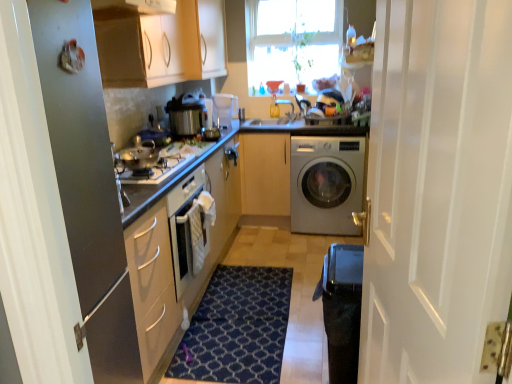
Question: Does white glossy washing machine at center have a greater height compared to black textured water heater at lower right?

Choices:
 (A) yes
 (B) no

Answer: (A)

Question: From the image's perspective, is white glossy washing machine at center beneath black textured water heater at lower right?

Choices:
 (A) yes
 (B) no

Answer: (B)

Question: Is white glossy washing machine at center smaller than black textured water heater at lower right?

Choices:
 (A) yes
 (B) no

Answer: (B)

Question: From a real-world perspective, is white glossy washing machine at center physically below black textured water heater at lower right?

Choices:
 (A) yes
 (B) no

Answer: (B)

Question: Considering the relative sizes of white glossy washing machine at center and black textured water heater at lower right in the image provided, is white glossy washing machine at center wider than black textured water heater at lower right?

Choices:
 (A) no
 (B) yes

Answer: (B)

Question: Considering the positions of metallic silver refrigerator at left and shiny silver gas stove at center left in the image, is metallic silver refrigerator at left bigger or smaller than shiny silver gas stove at center left?

Choices:
 (A) small
 (B) big

Answer: (B)

Question: From their relative heights in the image, would you say metallic silver refrigerator at left is taller or shorter than shiny silver gas stove at center left?

Choices:
 (A) tall
 (B) short

Answer: (A)

Question: Is point (96, 248) positioned closer to the camera than point (152, 178)?

Choices:
 (A) closer
 (B) farther

Answer: (A)

Question: Visually, is metallic silver refrigerator at left positioned to the left or to the right of shiny silver gas stove at center left?

Choices:
 (A) right
 (B) left

Answer: (A)

Question: Relative to white wood door at right, is translucent glass coffee cup at upper center in front or behind?

Choices:
 (A) front
 (B) behind

Answer: (B)

Question: Choose the correct answer: Is translucent glass coffee cup at upper center inside white wood door at right or outside it?

Choices:
 (A) outside
 (B) inside

Answer: (A)

Question: In terms of width, does translucent glass coffee cup at upper center look wider or thinner when compared to white wood door at right?

Choices:
 (A) thin
 (B) wide

Answer: (A)

Question: From the image's perspective, relative to white wood door at right, is translucent glass coffee cup at upper center above or below?

Choices:
 (A) below
 (B) above

Answer: (B)

Question: From the image's perspective, relative to black textured water heater at lower right, is dark blue textured rug at center above or below?

Choices:
 (A) above
 (B) below

Answer: (B)

Question: From their relative heights in the image, would you say dark blue textured rug at center is taller or shorter than black textured water heater at lower right?

Choices:
 (A) short
 (B) tall

Answer: (A)